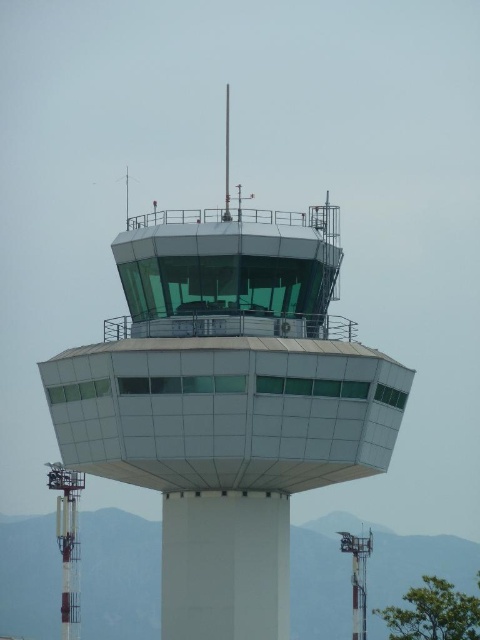
You are a pilot flying a small plane that requires a minimum of 90 meters of clearance to safely land. You observe the white glass tower at center from your current altitude. Can you safely descend to land?

The white glass tower at center is 91.49 meters away from the camera. Since your plane requires a minimum of 90 meters of clearance, you can safely descend to land as the distance is sufficient.

You are an air traffic controller standing at the base of the tower and want to locate the metallic antenna at lower right. Which direction should you look relative to the white glossy control tower at left?

The metallic antenna at lower right is to the right of the white glossy control tower at left, so you should look to the right side of the white glossy control tower at left to find it.

You are an air traffic controller in the tower and need to determine the relative positions of two points marked on the control panel. Based on the image, which point is closer to you, point (73, 627) or point (357, 572)?

Point (73, 627) is closer to the viewer than point (357, 572).